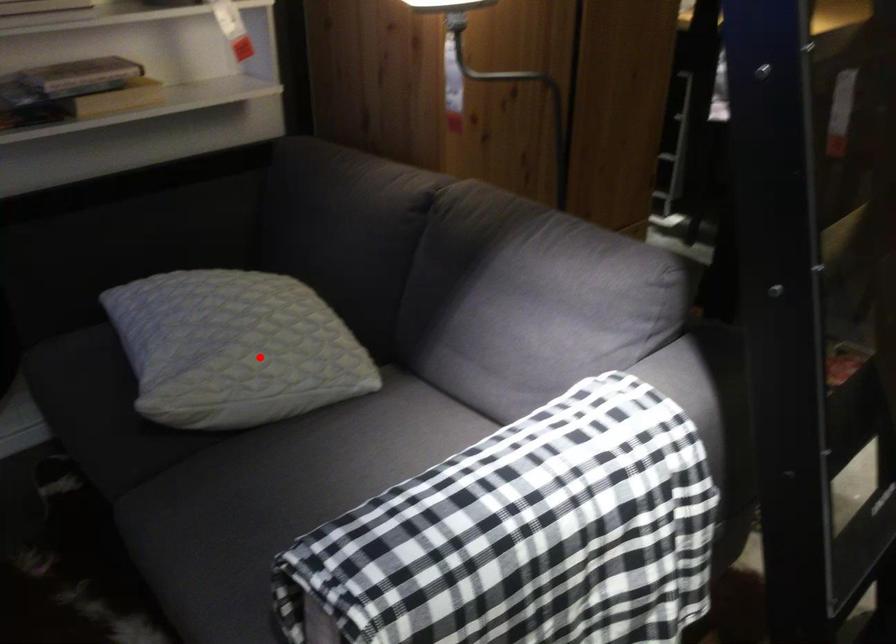
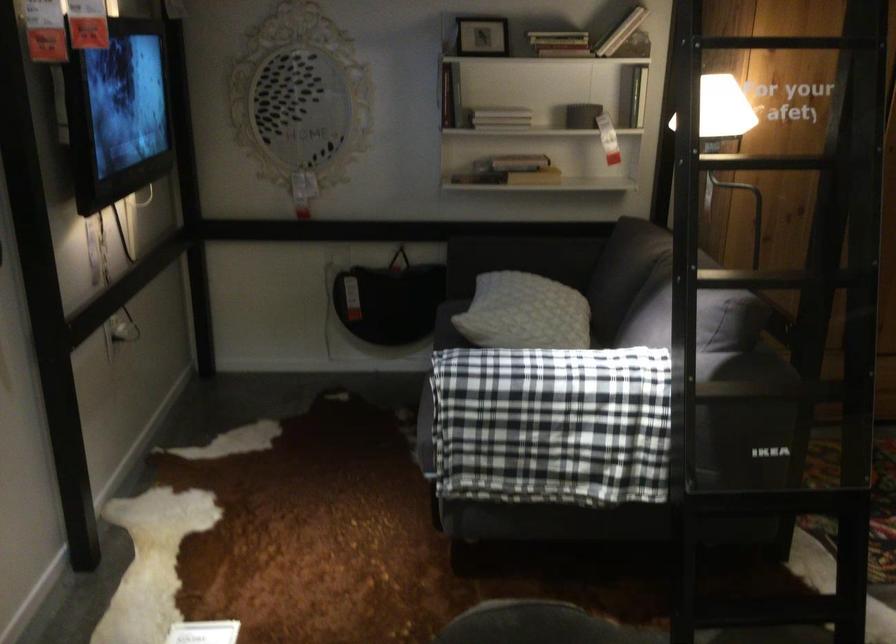
Question: I am providing you with two images of the same scene from different viewpoints. Given a red point in image1, look at the same physical point in image2. Is it:

Choices:
 (A) Closer to the viewpoint
 (B) Farther from the viewpoint

Answer: (B)